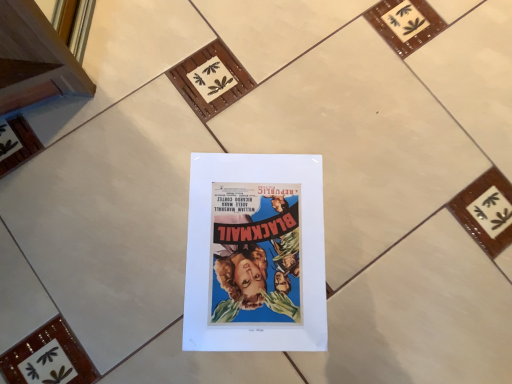
Locate an element on the screen. blank space situated above matte paper poster at center (from a real-world perspective) is located at coordinates (260, 250).